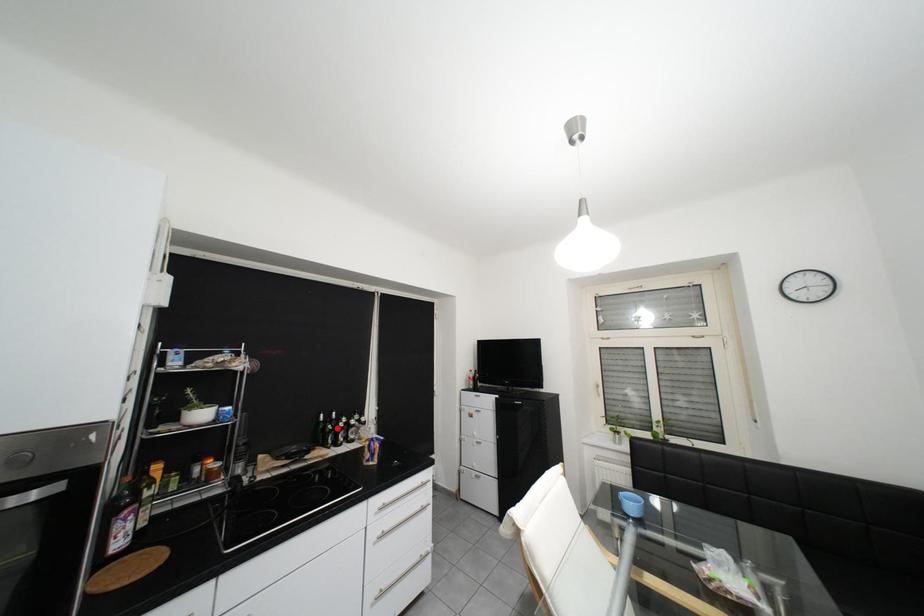
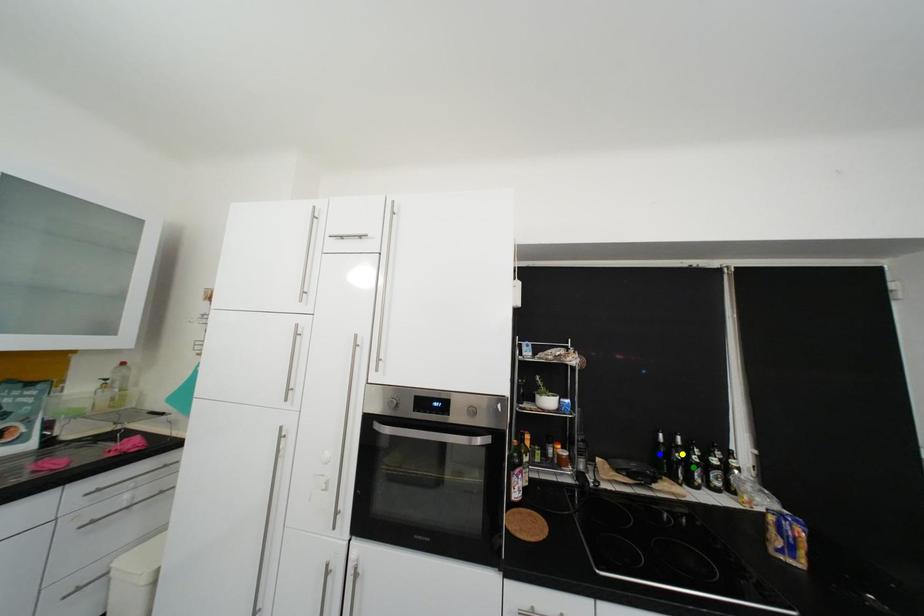
Question: I am providing you with two images of the same scene from different viewpoints. A red point is marked on the first image. You are given multiple points on the second image. Which point in image 2 is actually the same real-world point as the red point in image 1?

Choices:
 (A) blue point
 (B) green point
 (C) yellow point

Answer: (C)